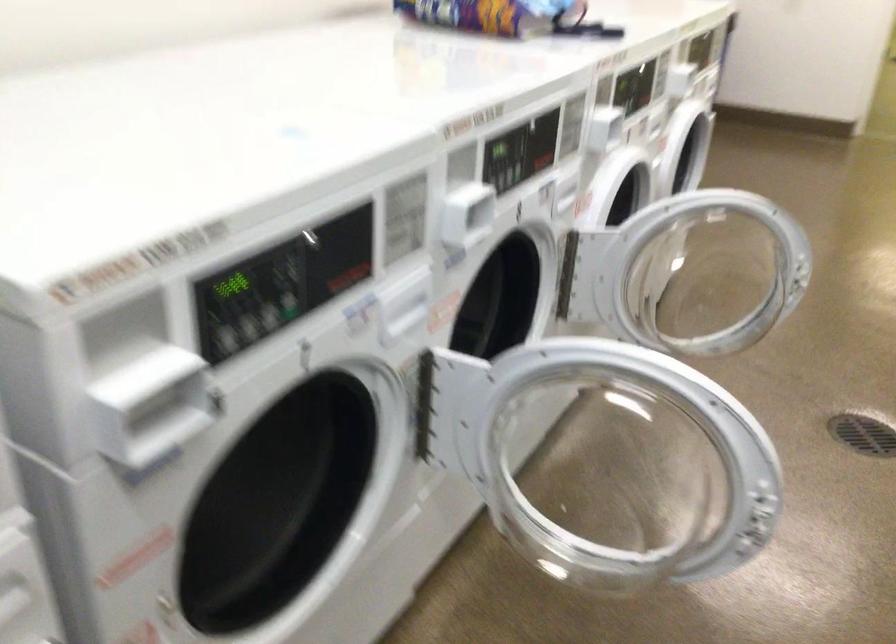
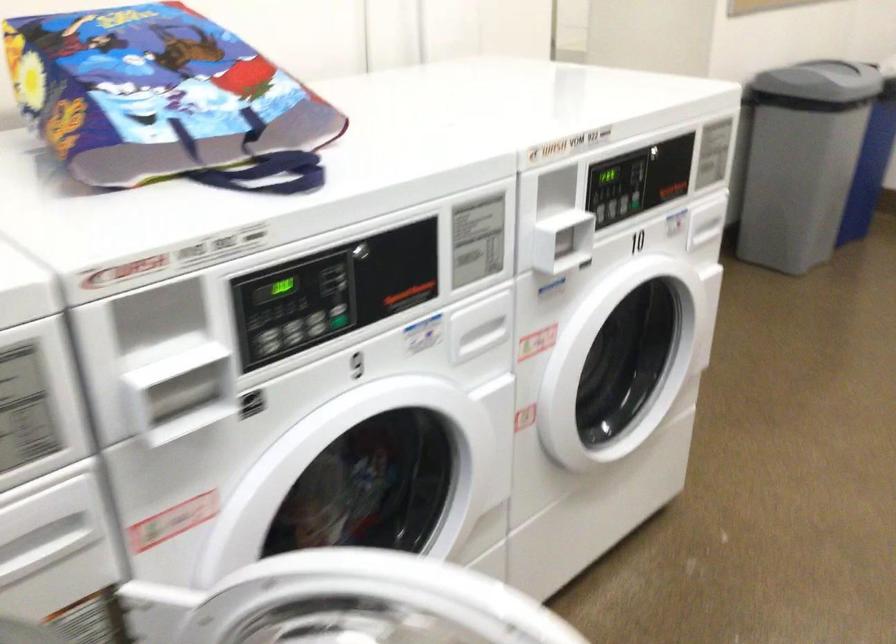
Question: The first image is from the beginning of the video and the second image is from the end. How did the camera likely rotate when shooting the video?

Choices:
 (A) Left
 (B) Right
 (C) Up
 (D) Down

Answer: (A)